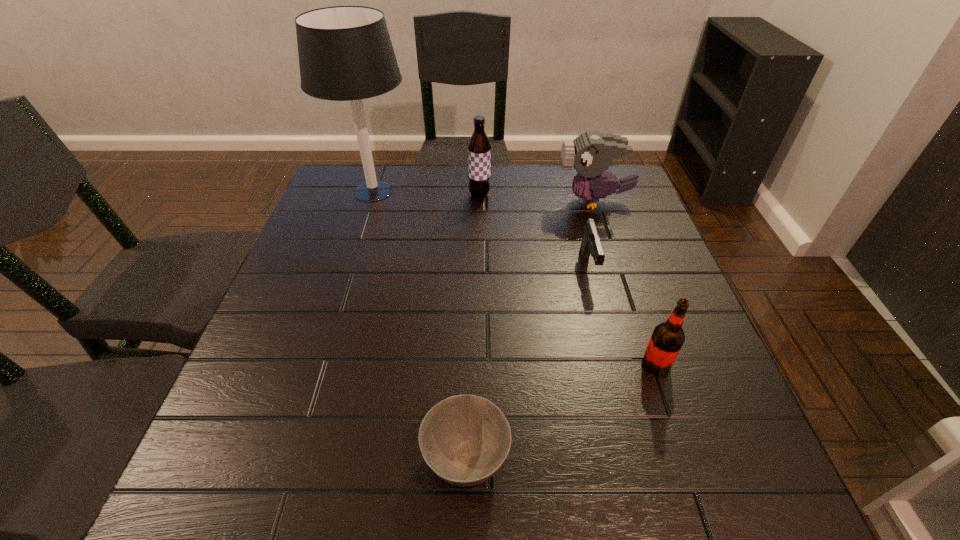
Identify the location of free area in between the shortest object and the bird. This screenshot has height=540, width=960. (530, 330).

Locate an element on the screen. The height and width of the screenshot is (540, 960). free space between the fourth farthest object and the taller root beer is located at coordinates (535, 231).

Locate an element on the screen. object identified as the second closest to the leftmost object is located at coordinates (591, 153).

Select which object appears as the second closest to the left root beer. Please provide its 2D coordinates. Your answer should be formatted as a tuple, i.e. [(x, y)], where the tuple contains the x and y coordinates of a point satisfying the conditions above.

[(591, 153)]

Where is `vacant space that satisfies the following two spatial constraints: 1. at the beak of the bird; 2. aim along the barrel of the fourth farthest object`? This screenshot has height=540, width=960. vacant space that satisfies the following two spatial constraints: 1. at the beak of the bird; 2. aim along the barrel of the fourth farthest object is located at coordinates (615, 267).

At what (x,y) coordinates should I click in order to perform the action: click on vacant point that satisfies the following two spatial constraints: 1. aim along the barrel of the pistol; 2. on the left side of the shorter root beer. Please return your answer as a coordinate pair (x, y). The width and height of the screenshot is (960, 540). Looking at the image, I should click on (614, 364).

In order to click on vacant region that satisfies the following two spatial constraints: 1. on the front side of the second nearest object; 2. on the left side of the taller root beer in this screenshot , I will do `click(479, 364)`.

Where is `free location that satisfies the following two spatial constraints: 1. at the beak of the bird; 2. on the right side of the right root beer`? The width and height of the screenshot is (960, 540). free location that satisfies the following two spatial constraints: 1. at the beak of the bird; 2. on the right side of the right root beer is located at coordinates (647, 364).

Where is `vacant space that satisfies the following two spatial constraints: 1. aim along the barrel of the second shortest object; 2. on the right side of the nearer root beer`? vacant space that satisfies the following two spatial constraints: 1. aim along the barrel of the second shortest object; 2. on the right side of the nearer root beer is located at coordinates (614, 364).